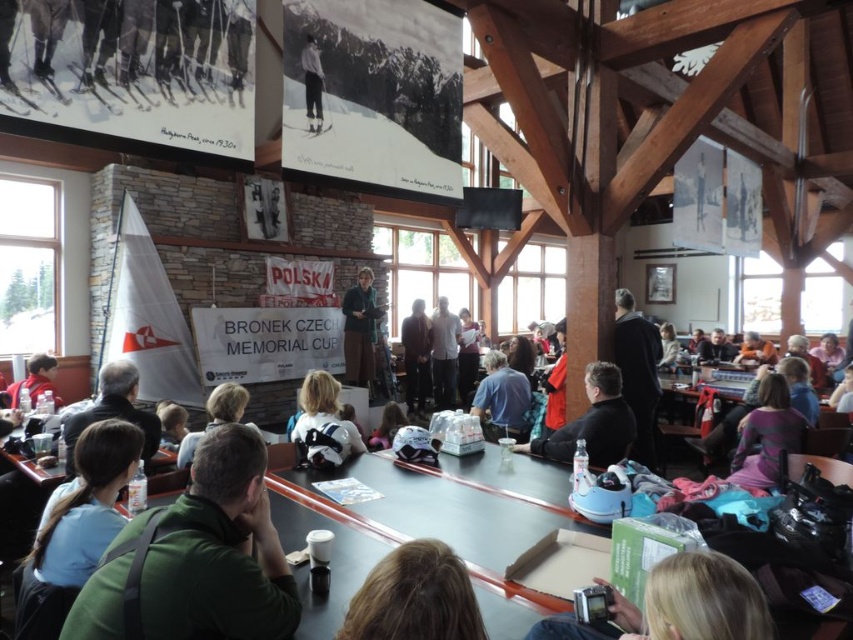
Is striped sweater at center above white matte helmet at center?

Incorrect, striped sweater at center is not positioned above white matte helmet at center.

Between striped sweater at center and white matte helmet at center, which one appears on the right side from the viewer's perspective?

Positioned to the right is striped sweater at center.

Is point (769, 396) farther from camera compared to point (360, 435)?

That is False.

Where is `striped sweater at center`? The image size is (853, 640). striped sweater at center is located at coordinates (766, 435).

Which of these two, blonde hair at lower center or dark brown hair at center, stands taller?

dark brown hair at center

Looking at this image, does blonde hair at lower center have a greater height compared to dark brown hair at center?

No, blonde hair at lower center is not taller than dark brown hair at center.

Is point (363, 616) less distant than point (207, 429)?

That is True.

At what (x,y) coordinates should I click in order to perform the action: click on blonde hair at lower center. Please return your answer as a coordinate pair (x, y). This screenshot has height=640, width=853. Looking at the image, I should click on coord(415,596).

Can you confirm if silvery metallic camera at lower center is taller than blonde hair at lower center?

Yes.

Is the position of silvery metallic camera at lower center less distant than that of blonde hair at lower center?

No, it is not.

The image size is (853, 640). Describe the element at coordinates (679, 604) in the screenshot. I see `silvery metallic camera at lower center` at that location.

Identify the location of silvery metallic camera at lower center. (679, 604).